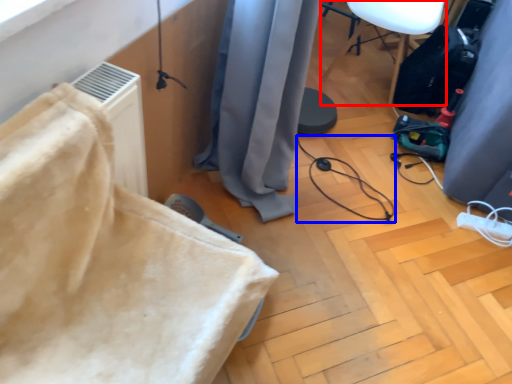
Question: Which object appears closest to the camera in this image, furniture (highlighted by a red box) or cable (highlighted by a blue box)?

Choices:
 (A) furniture
 (B) cable

Answer: (B)